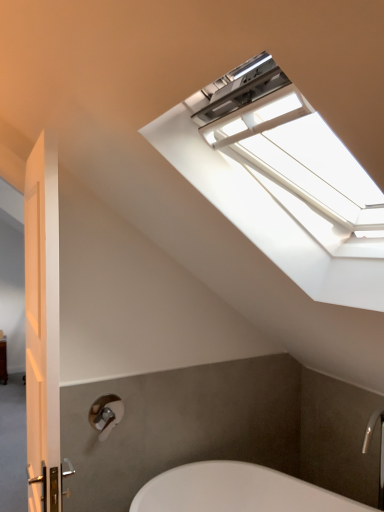
Question: Would you say white plastic window at upper center is part of silver metallic faucet at lower right's contents?

Choices:
 (A) yes
 (B) no

Answer: (B)

Question: Considering the relative sizes of silver metallic faucet at lower right and white plastic window at upper center in the image provided, is silver metallic faucet at lower right shorter than white plastic window at upper center?

Choices:
 (A) no
 (B) yes

Answer: (B)

Question: Is the depth of silver metallic faucet at lower right greater than that of white plastic window at upper center?

Choices:
 (A) no
 (B) yes

Answer: (B)

Question: Is silver metallic faucet at lower right smaller than white plastic window at upper center?

Choices:
 (A) no
 (B) yes

Answer: (B)

Question: Is silver metallic faucet at lower right taller than white plastic window at upper center?

Choices:
 (A) yes
 (B) no

Answer: (B)

Question: From the image's perspective, is matte silver shower at lower left above or below white plastic window at upper center?

Choices:
 (A) above
 (B) below

Answer: (B)

Question: Based on their sizes in the image, would you say matte silver shower at lower left is bigger or smaller than white plastic window at upper center?

Choices:
 (A) big
 (B) small

Answer: (B)

Question: Is matte silver shower at lower left to the left or to the right of white plastic window at upper center in the image?

Choices:
 (A) right
 (B) left

Answer: (B)

Question: Is matte silver shower at lower left spatially inside white plastic window at upper center, or outside of it?

Choices:
 (A) outside
 (B) inside

Answer: (A)

Question: Is point (357, 269) closer or farther from the camera than point (110, 429)?

Choices:
 (A) farther
 (B) closer

Answer: (B)

Question: Is white plastic window at upper center bigger or smaller than matte silver shower at lower left?

Choices:
 (A) small
 (B) big

Answer: (B)

Question: Considering their positions, is white plastic window at upper center located in front of or behind matte silver shower at lower left?

Choices:
 (A) front
 (B) behind

Answer: (A)

Question: From a real-world perspective, is white plastic window at upper center positioned above or below matte silver shower at lower left?

Choices:
 (A) above
 (B) below

Answer: (A)

Question: From the image's perspective, is matte silver shower at lower left above or below silver metallic faucet at lower right?

Choices:
 (A) above
 (B) below

Answer: (A)

Question: Based on their positions, is matte silver shower at lower left located to the left or right of silver metallic faucet at lower right?

Choices:
 (A) left
 (B) right

Answer: (A)